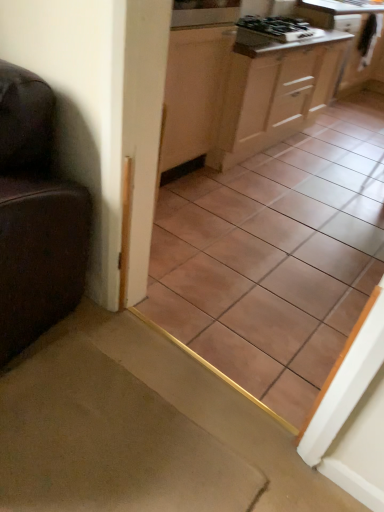
Question: Relative to carpet at lower left, is black glossy gas stove at upper center in front or behind?

Choices:
 (A) front
 (B) behind

Answer: (B)

Question: Which is correct: black glossy gas stove at upper center is inside carpet at lower left, or outside of it?

Choices:
 (A) inside
 (B) outside

Answer: (B)

Question: Which object is positioned farthest from the wooden cabinet at upper right, the 2th cabinetry viewed from the left?

Choices:
 (A) carpet at lower left
 (B) white glossy countertop at upper right
 (C) light wood cabinet at center, placed as the 1th cabinetry when sorted from left to right
 (D) black glossy gas stove at upper center
 (E) brown ceramic tile at center

Answer: (A)

Question: Which object is the closest to the carpet at lower left?

Choices:
 (A) white glossy countertop at upper right
 (B) brown ceramic tile at center
 (C) black glossy gas stove at upper center
 (D) light wood cabinet at center, marked as the second cabinetry in a back-to-front arrangement
 (E) wooden cabinet at upper right, the first cabinetry viewed from the back

Answer: (B)